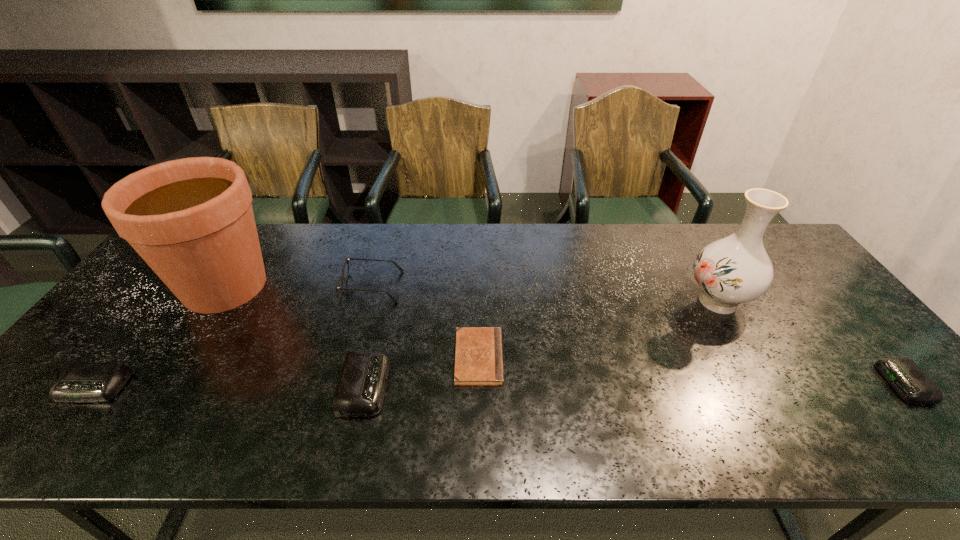
Where is `blank space at the far right corner of the desktop`? Image resolution: width=960 pixels, height=540 pixels. blank space at the far right corner of the desktop is located at coordinates (773, 249).

Where is `vacant space at the near right corner of the desktop`? The height and width of the screenshot is (540, 960). vacant space at the near right corner of the desktop is located at coordinates (875, 385).

The image size is (960, 540). In order to click on empty space between the sixth object from left to right and the third tallest object in this screenshot , I will do `click(545, 294)`.

Locate an element on the screen. The width and height of the screenshot is (960, 540). free space between the fifth shortest object and the rightmost object is located at coordinates (637, 335).

Identify the location of vacant point located between the sixth object from left to right and the rightmost alarm clock. (810, 342).

Find the location of `free space between the second alarm clock from right to left and the vase`. free space between the second alarm clock from right to left and the vase is located at coordinates (541, 343).

This screenshot has width=960, height=540. In order to click on vacant space in between the fifth object from left to right and the leftmost alarm clock in this screenshot , I will do `click(286, 373)`.

Image resolution: width=960 pixels, height=540 pixels. What are the coordinates of `vacant space that is in between the diary and the flowerpot` in the screenshot? It's located at (352, 322).

I want to click on free space between the diary and the spectacles, so click(425, 322).

At what (x,y) coordinates should I click in order to perform the action: click on empty space between the rightmost alarm clock and the shortest object. Please return your answer as a coordinate pair (x, y). This screenshot has height=540, width=960. Looking at the image, I should click on (691, 370).